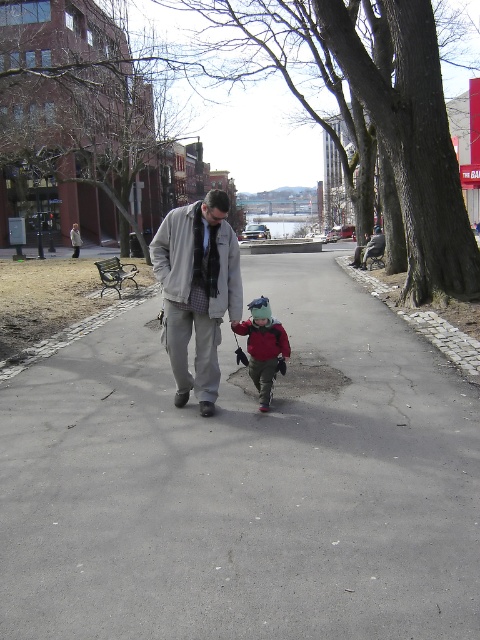
What do you see at coordinates (196, 291) in the screenshot? This screenshot has width=480, height=640. I see `gray woolen jacket at center` at bounding box center [196, 291].

Between gray woolen jacket at center and matte red jacket at center, which one appears on the left side from the viewer's perspective?

From the viewer's perspective, gray woolen jacket at center appears more on the left side.

What do you see at coordinates (196, 291) in the screenshot? The width and height of the screenshot is (480, 640). I see `gray woolen jacket at center` at bounding box center [196, 291].

In order to click on gray woolen jacket at center in this screenshot , I will do [196, 291].

Which is above, gray asphalt pavement at center or gray woolen jacket at center?

gray woolen jacket at center

Does gray asphalt pavement at center have a lesser height compared to gray woolen jacket at center?

Yes.

Locate an element on the screen. gray asphalt pavement at center is located at coordinates (243, 484).

Does gray asphalt pavement at center appear over matte red jacket at center?

No, gray asphalt pavement at center is not above matte red jacket at center.

Which is below, gray asphalt pavement at center or matte red jacket at center?

gray asphalt pavement at center is below.

At what (x,y) coordinates should I click in order to perform the action: click on gray asphalt pavement at center. Please return your answer as a coordinate pair (x, y). This screenshot has width=480, height=640. Looking at the image, I should click on (243, 484).